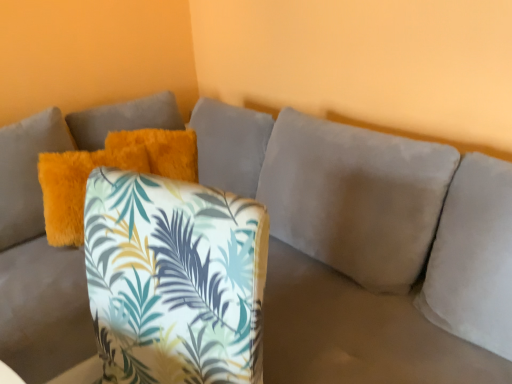
Question: Considering the positions of fluffy orange pillow at upper left and printed fabric cushion at center in the image, is fluffy orange pillow at upper left taller or shorter than printed fabric cushion at center?

Choices:
 (A) tall
 (B) short

Answer: (B)

Question: From a real-world perspective, is fluffy orange pillow at upper left physically located above or below printed fabric cushion at center?

Choices:
 (A) below
 (B) above

Answer: (B)

Question: Is fluffy orange pillow at upper left situated inside printed fabric cushion at center or outside?

Choices:
 (A) outside
 (B) inside

Answer: (A)

Question: Looking at their shapes, would you say printed fabric cushion at center is wider or thinner than fluffy orange pillow at upper left?

Choices:
 (A) thin
 (B) wide

Answer: (B)

Question: Choose the correct answer: Is printed fabric cushion at center inside fluffy orange pillow at upper left or outside it?

Choices:
 (A) inside
 (B) outside

Answer: (B)

Question: Considering the relative positions of printed fabric cushion at center and fluffy orange pillow at upper left in the image provided, is printed fabric cushion at center to the left or to the right of fluffy orange pillow at upper left?

Choices:
 (A) right
 (B) left

Answer: (A)

Question: From a real-world perspective, is printed fabric cushion at center physically located above or below fluffy orange pillow at upper left?

Choices:
 (A) above
 (B) below

Answer: (B)